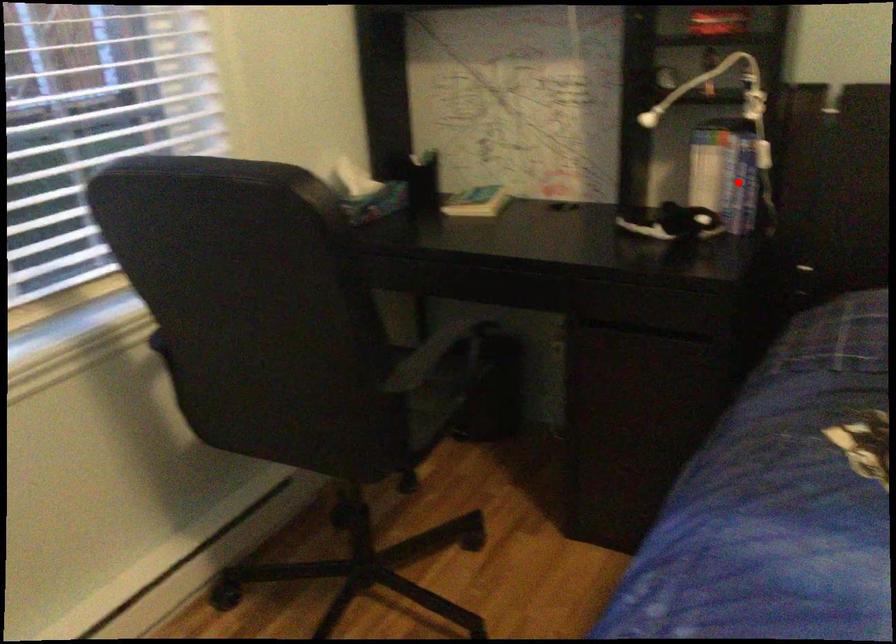
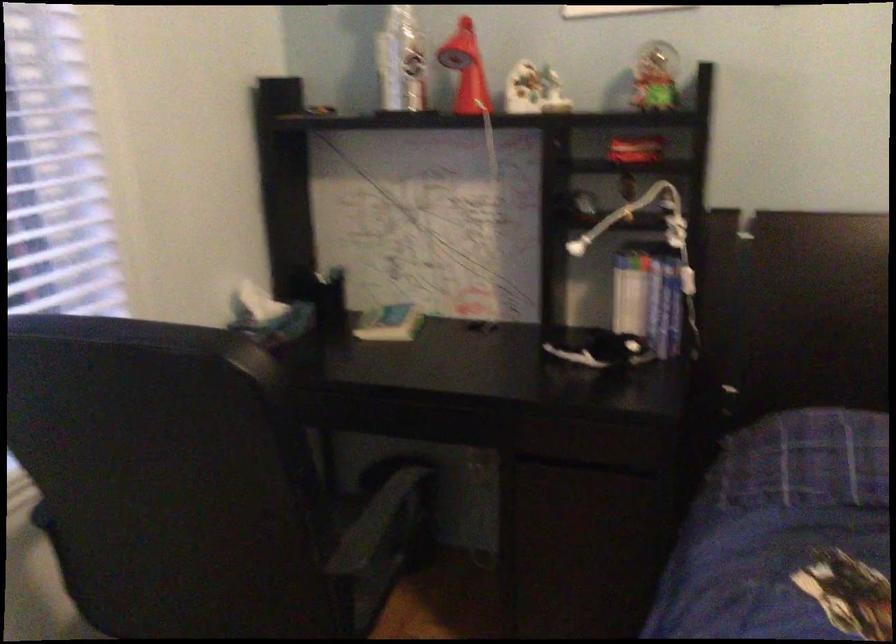
Question: I am providing you with two images of the same scene from different viewpoints. A red point is marked on the first image. Can you still see the location of the red point in image 2?

Choices:
 (A) Yes
 (B) No

Answer: (A)